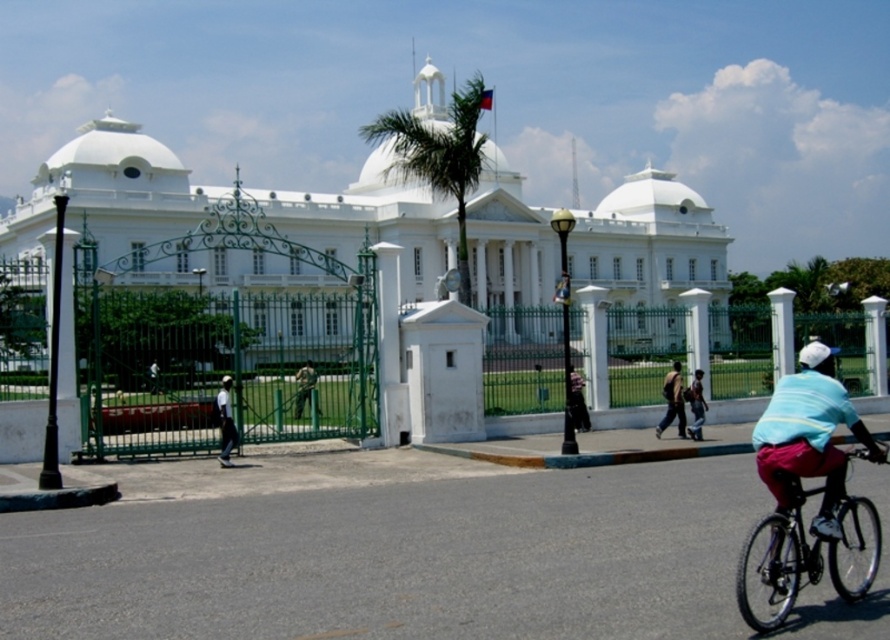
Question: Is dark blue shirt at center wider than white matte bicycle helmet at upper right?

Choices:
 (A) no
 (B) yes

Answer: (A)

Question: Which point appears closest to the camera in this image?

Choices:
 (A) (166, 193)
 (B) (698, 420)

Answer: (B)

Question: Which point is closer to the camera?

Choices:
 (A) (818, 355)
 (B) (298, 401)

Answer: (A)

Question: Is white glossy building at center above white matte bicycle helmet at upper right?

Choices:
 (A) no
 (B) yes

Answer: (B)

Question: Which point is closer to the camera taking this photo?

Choices:
 (A) (309, 369)
 (B) (649, 164)
 (C) (698, 429)

Answer: (C)

Question: Is white fabric shirt at center positioned in front of camouflage fabric jacket at center?

Choices:
 (A) yes
 (B) no

Answer: (A)